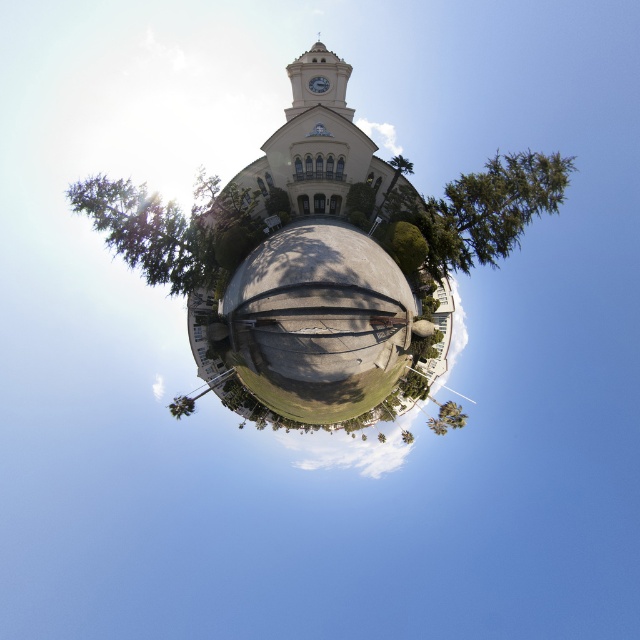
You are standing at the point marked as point [172,406], and you want to take a photo of the clock tower on the building. Since the sun is causing a lens flare on the left side of the image, which direction should you move to avoid the glare?

Move to the right to avoid the lens flare caused by the sun on the left side of the image.

You are standing in front of the beige stone church at center and want to take a photo of the green leafy tree at upper center. Since the church is blocking your view, can you move to the right or left to get an unobstructed shot?

The beige stone church at center is positioned over the green leafy tree at upper center, so moving to the right or left might allow you to see around the church and capture the tree in your photo.

You are standing at point [262,278] and want to walk to the clock tower on the building. The path is straight. If your walking speed is 3 feet per second, how many seconds will it take to reach the base of the clock tower?

The distance between point [262,278] and the clock tower is 287.20 feet. At a walking speed of 3 feet per second, it will take 287.20 divided by 3, which equals approximately 95.73 seconds to reach the base of the clock tower.